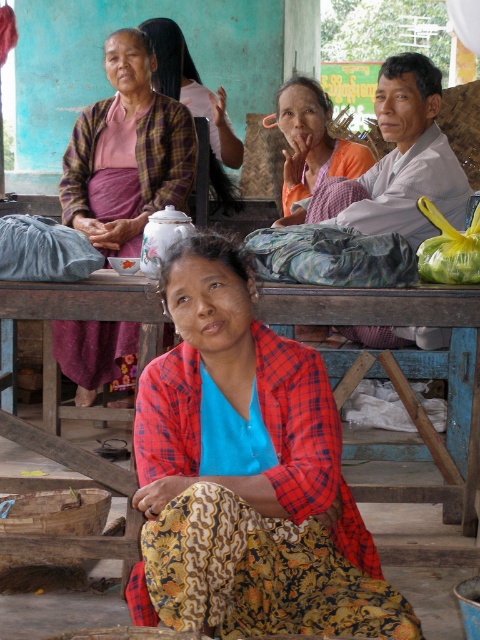
You are standing in front of the scene and want to touch the two points mentioned. Which point, point (217, 596) or point (80, 160), will require you to reach further out?

Point (80, 160) will require you to reach further out because it is farther away from the viewer compared to point (217, 596).

You are organizing a small event and need to place a centerpiece on the wooden table at center. However, there is an orange fabric at center. Where should you place the centerpiece?

The wooden table at center is located below the orange fabric at center, so you should place the centerpiece on the wooden table at center below the orange fabric at center.